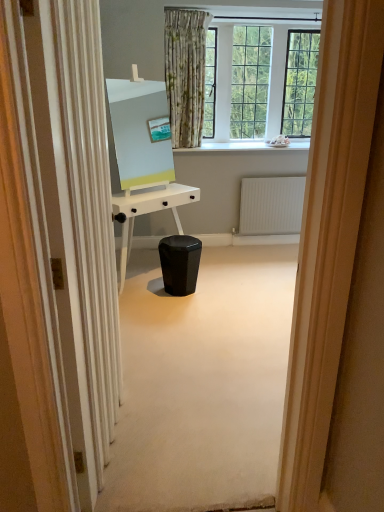
This screenshot has height=512, width=384. Find the location of `vacant space underneath white glossy screen door at left (from a real-world perspective)`. vacant space underneath white glossy screen door at left (from a real-world perspective) is located at coordinates (121, 435).